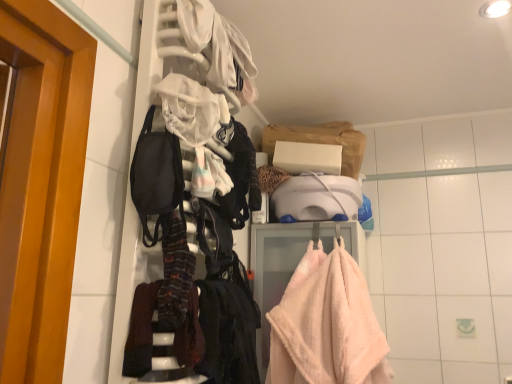
Question: Is soft pink plush towel at center in front of or behind black fabric at center in the image?

Choices:
 (A) front
 (B) behind

Answer: (B)

Question: From the image's perspective, is soft pink plush towel at center positioned above or below black fabric at center?

Choices:
 (A) below
 (B) above

Answer: (A)

Question: Estimate the real-world distances between objects in this image. Which object is closer to the black fabric mask at left?

Choices:
 (A) black fabric at center
 (B) soft pink plush towel at center

Answer: (A)

Question: Which is farther from the soft pink plush towel at center?

Choices:
 (A) black fabric at center
 (B) black fabric mask at left

Answer: (B)